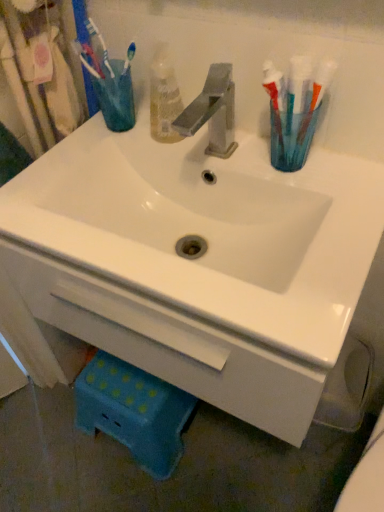
Question: Looking at their shapes, would you say translucent plastic toothbrush holder at upper right, the first turquoise positioned from the right, is wider or thinner than brushed metal toothbrush at upper left?

Choices:
 (A) thin
 (B) wide

Answer: (B)

Question: Is translucent plastic toothbrush holder at upper right, the first turquoise positioned from the right, to the left or to the right of brushed metal toothbrush at upper left in the image?

Choices:
 (A) right
 (B) left

Answer: (A)

Question: Estimate the real-world distances between objects in this image. Which object is closer to the translucent plastic cup at upper left, which is the second turquoise in right-to-left order?

Choices:
 (A) translucent plastic toothbrush holder at upper right, positioned as the second turquoise in top-to-bottom order
 (B) brushed metal toothbrush at upper left
 (C) white glossy sink at center

Answer: (B)

Question: Which object is positioned closest to the white glossy sink at center?

Choices:
 (A) brushed metal toothbrush at upper left
 (B) translucent plastic cup at upper left, which is counted as the 2th turquoise, starting from the front
 (C) translucent plastic toothbrush holder at upper right, which is counted as the first turquoise, starting from the front

Answer: (C)